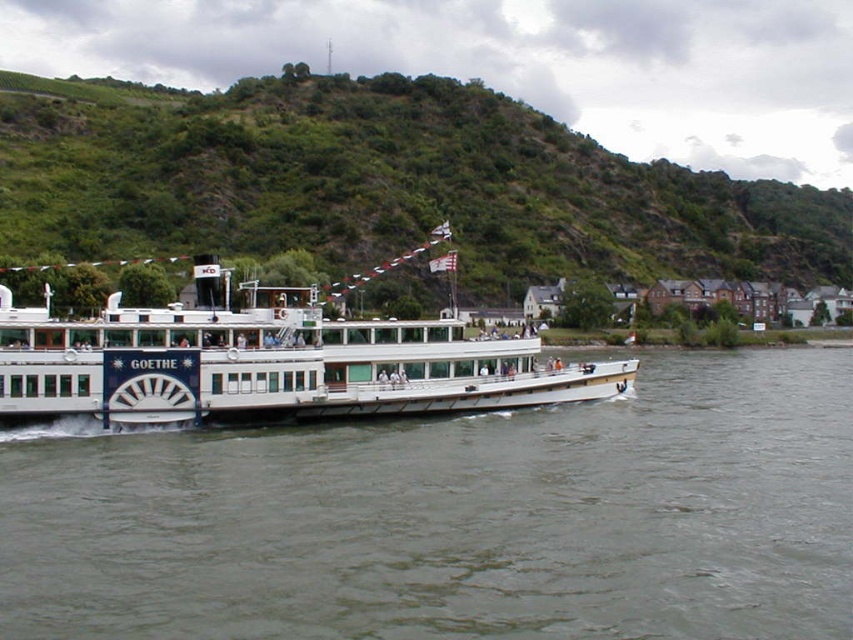
You are standing on the deck of the white matte cruise ship at center and want to take a photo of the green grassy hillside at upper center. In which direction should you point your camera?

You should point your camera to the right side of the white matte cruise ship at center to capture the green grassy hillside at upper center, as it is located to the right of the ship.

You are a tourist on the Goethe steamboat and looking at the scene. Which object is positioned lower in the image, the gray water at center or the green grassy hillside at upper center?

The gray water at center is located below the green grassy hillside at upper center, so the gray water at center is positioned lower in the image.

You are an observer on the deck of the Goethe steamboat. You notice the gray water at center and the green grassy hillside at upper center in the scene. Which object appears taller from your viewpoint?

The green grassy hillside at upper center appears taller than the gray water at center from your viewpoint.